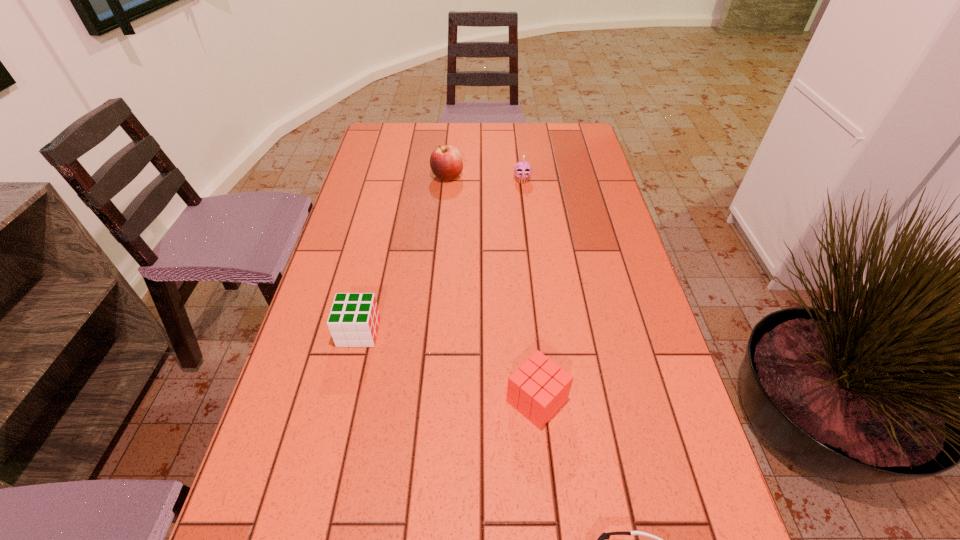
The height and width of the screenshot is (540, 960). I want to click on free space between the third nearest object and the nearer cube, so click(x=448, y=366).

Image resolution: width=960 pixels, height=540 pixels. What are the coordinates of `empty space between the leftmost object and the nearer cube` in the screenshot? It's located at (448, 366).

Where is `vacant space that's between the tallest object and the cupcake`? The height and width of the screenshot is (540, 960). vacant space that's between the tallest object and the cupcake is located at coordinates (485, 179).

Identify the location of free area in between the tallest object and the farther cube. 403,254.

Choose which object is the second nearest neighbor to the left cube. Please provide its 2D coordinates. Your answer should be formatted as a tuple, i.e. [(x, y)], where the tuple contains the x and y coordinates of a point satisfying the conditions above.

[(603, 539)]

Identify which object is the fourth closest to the second object from left to right. Please provide its 2D coordinates. Your answer should be formatted as a tuple, i.e. [(x, y)], where the tuple contains the x and y coordinates of a point satisfying the conditions above.

[(603, 539)]

Locate an element on the screen. free space that satisfies the following two spatial constraints: 1. on the red face of the second nearest object; 2. on the right side of the leftmost object is located at coordinates (343, 401).

Where is `blank area in the image that satisfies the following two spatial constraints: 1. on the red face of the left cube; 2. on the left side of the right cube`? blank area in the image that satisfies the following two spatial constraints: 1. on the red face of the left cube; 2. on the left side of the right cube is located at coordinates (343, 401).

The width and height of the screenshot is (960, 540). Find the location of `blank space that satisfies the following two spatial constraints: 1. on the red face of the farther cube; 2. on the right side of the right cube`. blank space that satisfies the following two spatial constraints: 1. on the red face of the farther cube; 2. on the right side of the right cube is located at coordinates (343, 401).

This screenshot has width=960, height=540. In order to click on vacant space that satisfies the following two spatial constraints: 1. on the front side of the apple; 2. on the red face of the left cube in this screenshot , I will do `click(433, 332)`.